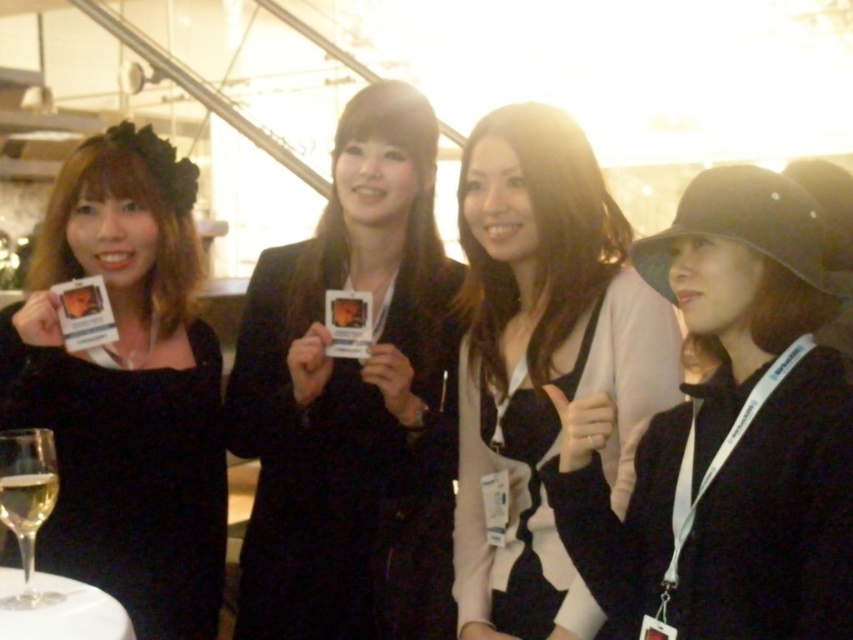
Can you confirm if black matte hat at right is bigger than black matte dress at center?

Yes.

Which of these two, black matte hat at right or black matte dress at center, stands shorter?

With less height is black matte dress at center.

Who is more forward, [764,346] or [535,404]?

Positioned in front is point [764,346].

In order to click on black matte hat at right in this screenshot , I will do `click(727, 435)`.

Based on the photo, who is more forward, (361, 257) or (521, 435)?

Point (521, 435)

Is black matte jacket at center to the left of black matte dress at center from the viewer's perspective?

Indeed, black matte jacket at center is positioned on the left side of black matte dress at center.

What do you see at coordinates (352, 401) in the screenshot? I see `black matte jacket at center` at bounding box center [352, 401].

Locate an element on the screen. Image resolution: width=853 pixels, height=640 pixels. black matte jacket at center is located at coordinates (352, 401).

Can you confirm if black matte jacket at center is positioned to the left of clear glass wine at lower left?

No, black matte jacket at center is not to the left of clear glass wine at lower left.

Is point (303, 456) behind point (15, 525)?

That is True.

Is point (358, 625) more distant than point (10, 483)?

Yes.

At what (x,y) coordinates should I click in order to perform the action: click on black matte jacket at center. Please return your answer as a coordinate pair (x, y). Looking at the image, I should click on (352, 401).